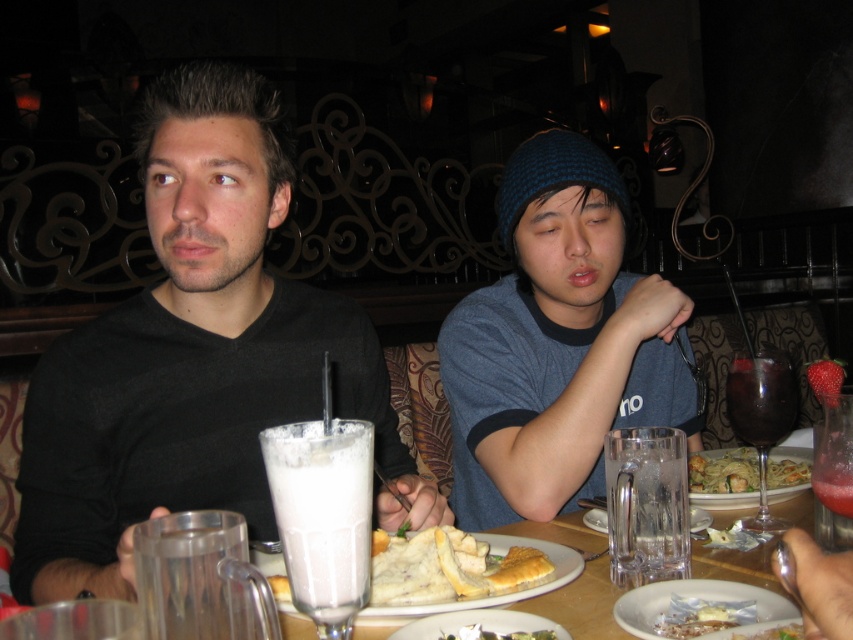
Question: Is white matte plate at center to the right of white porcelain plate at lower right from the viewer's perspective?

Choices:
 (A) yes
 (B) no

Answer: (B)

Question: Which of the following is the farthest from the observer?

Choices:
 (A) white frothy milkshake at center
 (B) black matte shirt at center
 (C) white matte plate at center

Answer: (C)

Question: Can you confirm if blue knit cap at center is bigger than white porcelain plate at center?

Choices:
 (A) yes
 (B) no

Answer: (A)

Question: Which point is farther to the camera?

Choices:
 (A) matte glass plate at center
 (B) white matte plate at center
 (C) white porcelain plate at lower right

Answer: (A)

Question: Which object appears farthest from the camera in this image?

Choices:
 (A) white frothy milkshake at center
 (B) blue knit cap at center
 (C) black matte shirt at center
 (D) dark red glass at right

Answer: (B)

Question: Is white porcelain plate at center wider than green matte pasta at center?

Choices:
 (A) no
 (B) yes

Answer: (A)